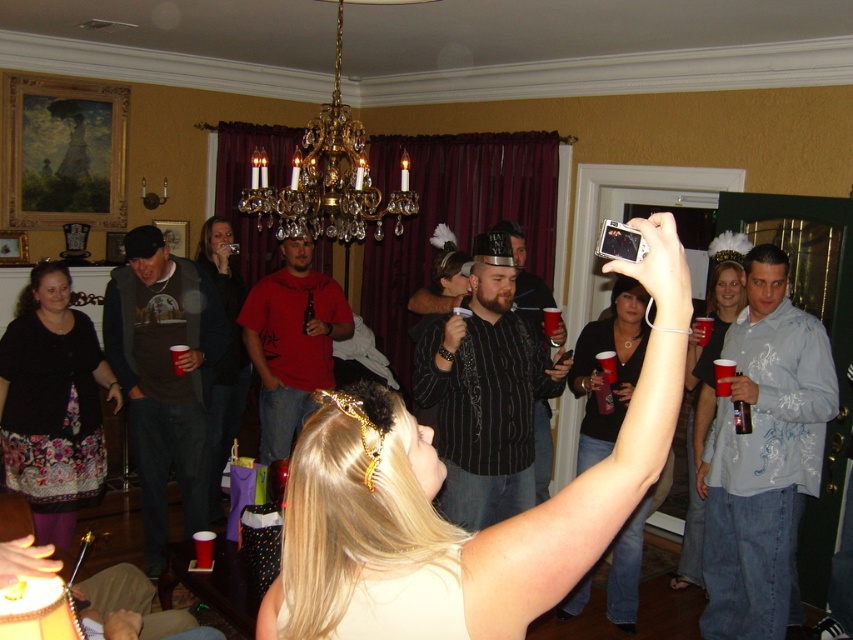
Can you confirm if red cotton shirt at center is positioned to the left of matte plastic cup at center?

Incorrect, red cotton shirt at center is not on the left side of matte plastic cup at center.

Who is positioned more to the left, red cotton shirt at center or matte plastic cup at center?

Positioned to the left is matte plastic cup at center.

Which is behind, point (252, 308) or point (184, 344)?

Positioned behind is point (252, 308).

At what (x,y) coordinates should I click in order to perform the action: click on red cotton shirt at center. Please return your answer as a coordinate pair (x, y). This screenshot has height=640, width=853. Looking at the image, I should click on (291, 342).

Which is below, floral-patterned skirt at center or red plastic cup at center?

Positioned lower is floral-patterned skirt at center.

Is point (15, 468) behind point (543, 310)?

No, it is not.

Is point (96, 486) behind point (544, 333)?

That is False.

The image size is (853, 640). I want to click on floral-patterned skirt at center, so click(x=51, y=404).

Can you confirm if white textured shirt at center is positioned to the left of black matte dress at upper center?

No, white textured shirt at center is not to the left of black matte dress at upper center.

The width and height of the screenshot is (853, 640). What do you see at coordinates (762, 452) in the screenshot?
I see `white textured shirt at center` at bounding box center [762, 452].

Does point (752, 593) come in front of point (618, 406)?

Yes, it is.

Find the location of a particular element. This screenshot has height=640, width=853. white textured shirt at center is located at coordinates [x=762, y=452].